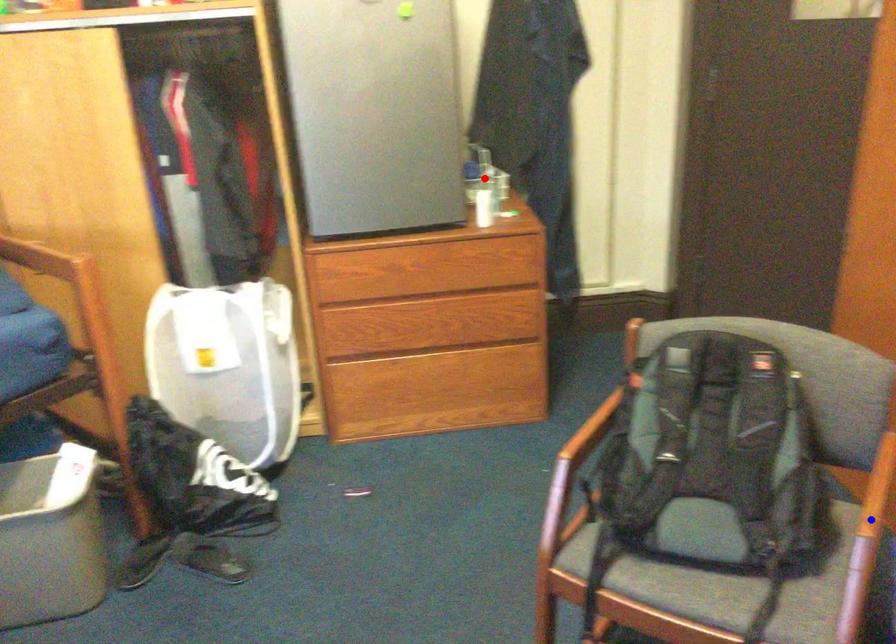
Question: In the image, two points are highlighted. Which point is nearer to the camera? Reply with the corresponding letter.

Choices:
 (A) blue point
 (B) red point

Answer: (A)